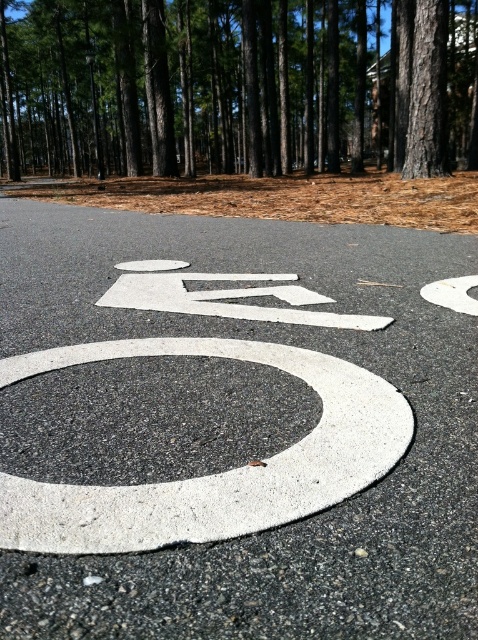
Question: Does white painted number at center appear on the right side of brown rough tree at upper right?

Choices:
 (A) no
 (B) yes

Answer: (A)

Question: Is white concrete circle at center positioned in front of brown rough tree at upper right?

Choices:
 (A) no
 (B) yes

Answer: (B)

Question: Which point appears closest to the camera in this image?

Choices:
 (A) (133, 298)
 (B) (428, 76)
 (C) (389, 90)

Answer: (A)

Question: Does white concrete circle at center appear over brown rough tree at upper right?

Choices:
 (A) no
 (B) yes

Answer: (A)

Question: Which object is positioned closest to the brown rough tree at upper right?

Choices:
 (A) white painted number at center
 (B) white concrete circle at center

Answer: (A)

Question: Which point is farther from the camera taking this photo?

Choices:
 (A) (434, 145)
 (B) (164, 268)
 (C) (50, 504)

Answer: (A)